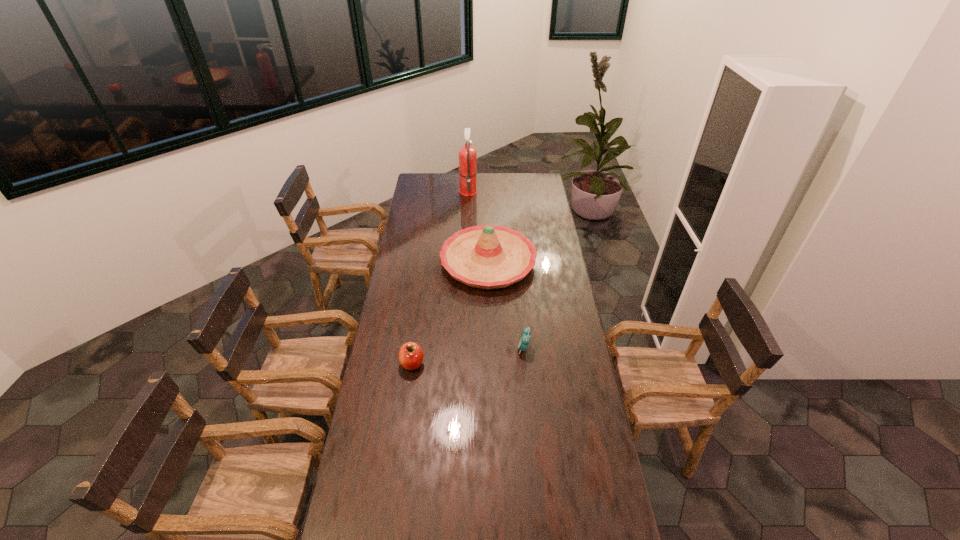
Where is `the farthest object`? This screenshot has width=960, height=540. the farthest object is located at coordinates [467, 155].

Locate an element on the screen. The width and height of the screenshot is (960, 540). the tallest object is located at coordinates (467, 155).

What are the coordinates of `sombrero` in the screenshot? It's located at (488, 257).

Identify the location of the second tallest object. This screenshot has height=540, width=960. (488, 257).

Find the location of a particular element. This screenshot has height=540, width=960. alarm clock is located at coordinates (524, 340).

The width and height of the screenshot is (960, 540). What are the coordinates of `the leftmost object` in the screenshot? It's located at (410, 356).

Where is `vacant point located 0.090m with the handle and hose on the tallest object`? The height and width of the screenshot is (540, 960). vacant point located 0.090m with the handle and hose on the tallest object is located at coordinates (492, 190).

You are a GUI agent. You are given a task and a screenshot of the screen. Output one action in this format:
    pyautogui.click(x=<x>, y=<y>)
    Task: Click on the blank area located 0.110m on the front of the third nearest object
    Image resolution: width=960 pixels, height=540 pixels.
    Given the screenshot: What is the action you would take?
    pyautogui.click(x=490, y=312)

The width and height of the screenshot is (960, 540). Identify the location of free point located 0.260m on the face of the alarm clock. (455, 348).

I want to click on vacant position located 0.380m on the face of the alarm clock, so click(x=427, y=348).